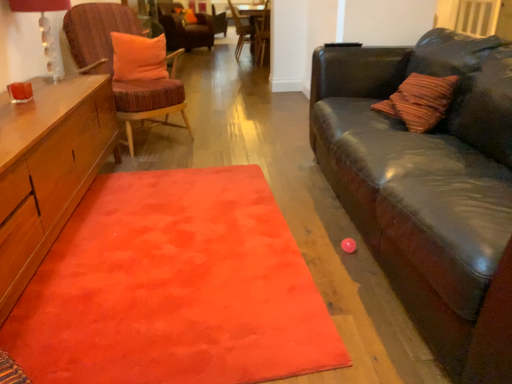
Question: Is wooden textured chair at upper center, which is counted as the 2th chair, starting from the back, far away from matte glass lampshade at upper left?

Choices:
 (A) yes
 (B) no

Answer: (A)

Question: Is wooden textured chair at upper center, positioned as the third chair in front-to-back order, not inside matte glass lampshade at upper left?

Choices:
 (A) yes
 (B) no

Answer: (A)

Question: Considering the relative sizes of wooden textured chair at upper center, which is counted as the 2th chair, starting from the back, and matte glass lampshade at upper left in the image provided, is wooden textured chair at upper center, which is counted as the 2th chair, starting from the back, taller than matte glass lampshade at upper left?

Choices:
 (A) yes
 (B) no

Answer: (A)

Question: Can you confirm if wooden textured chair at upper center, positioned as the third chair in front-to-back order, is shorter than matte glass lampshade at upper left?

Choices:
 (A) yes
 (B) no

Answer: (B)

Question: Does wooden textured chair at upper center, which is counted as the 2th chair, starting from the back, contain matte glass lampshade at upper left?

Choices:
 (A) yes
 (B) no

Answer: (B)

Question: From a real-world perspective, is wooden chair at center, the 3th chair in the back-to-front sequence, above or below orange fabric pillow at upper center, which is the 2th pillow in right-to-left order?

Choices:
 (A) below
 (B) above

Answer: (A)

Question: In terms of height, does wooden chair at center, which is the second chair from front to back, look taller or shorter compared to orange fabric pillow at upper center, the second pillow viewed from the front?

Choices:
 (A) tall
 (B) short

Answer: (A)

Question: From the image's perspective, is wooden chair at center, which is the second chair from front to back, located above or below orange fabric pillow at upper center, placed as the first pillow when sorted from left to right?

Choices:
 (A) below
 (B) above

Answer: (A)

Question: Considering the positions of wooden chair at center, the 3th chair in the back-to-front sequence, and orange fabric pillow at upper center, the second pillow viewed from the front, in the image, is wooden chair at center, the 3th chair in the back-to-front sequence, wider or thinner than orange fabric pillow at upper center, the second pillow viewed from the front,?

Choices:
 (A) wide
 (B) thin

Answer: (A)

Question: Is velvet orange cushion at upper center, which is the 4th chair in front-to-back order, taller or shorter than matte glass lampshade at upper left?

Choices:
 (A) tall
 (B) short

Answer: (A)

Question: Considering their positions, is velvet orange cushion at upper center, which is the 4th chair in front-to-back order, located in front of or behind matte glass lampshade at upper left?

Choices:
 (A) front
 (B) behind

Answer: (B)

Question: Looking at their shapes, would you say velvet orange cushion at upper center, the 1th chair when ordered from back to front, is wider or thinner than matte glass lampshade at upper left?

Choices:
 (A) wide
 (B) thin

Answer: (A)

Question: Does point (167, 41) appear closer or farther from the camera than point (40, 38)?

Choices:
 (A) closer
 (B) farther

Answer: (B)

Question: Does point (198, 16) appear closer or farther from the camera than point (242, 14)?

Choices:
 (A) closer
 (B) farther

Answer: (B)

Question: Considering the positions of velvet orange cushion at upper center, which is the 4th chair in front-to-back order, and wooden side table at center in the image, is velvet orange cushion at upper center, which is the 4th chair in front-to-back order, wider or thinner than wooden side table at center?

Choices:
 (A) wide
 (B) thin

Answer: (B)